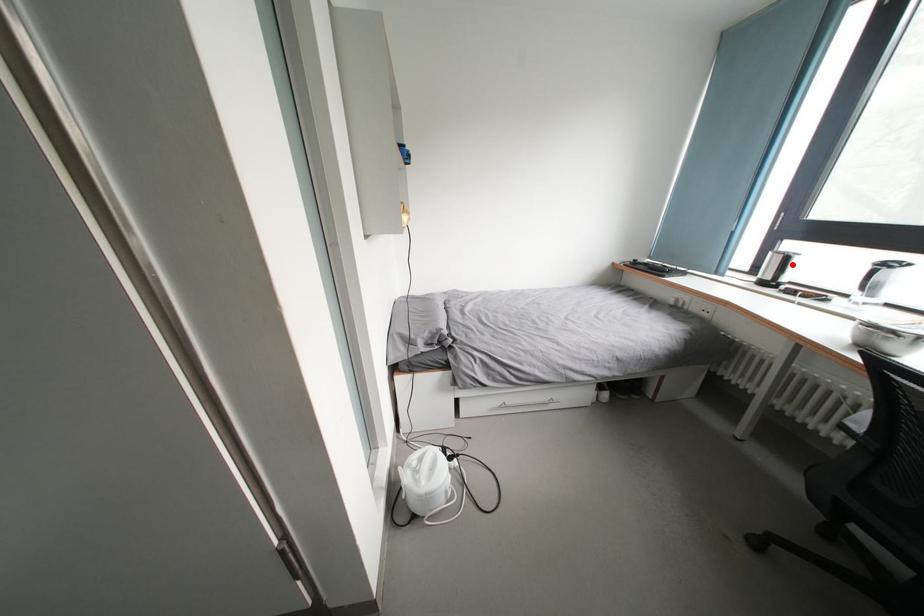
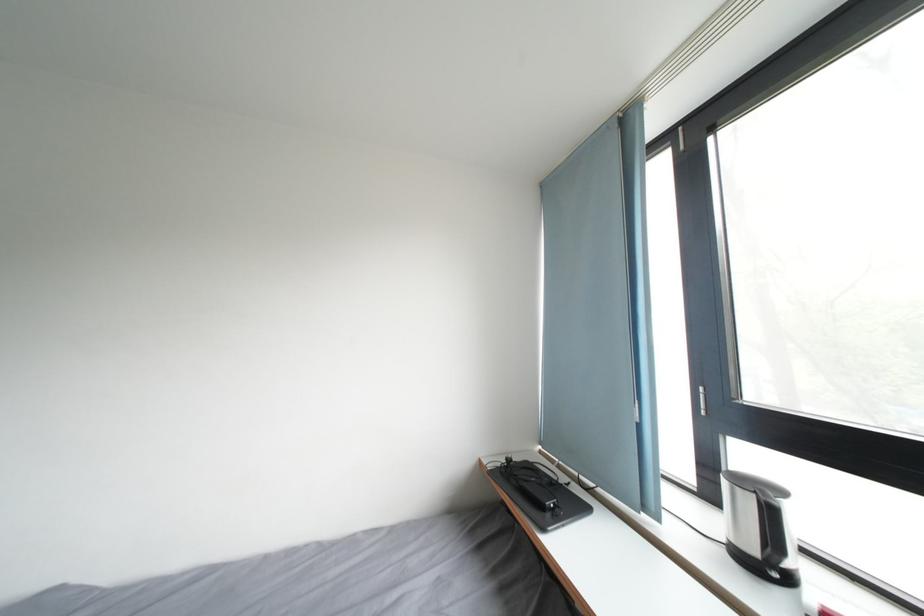
Question: A red point is marked in image1. In image2, is the corresponding 3D point closer to the camera or farther? Reply with the corresponding letter.

Choices:
 (A) The corresponding 3D point is closer.
 (B) The corresponding 3D point is farther.

Answer: (A)